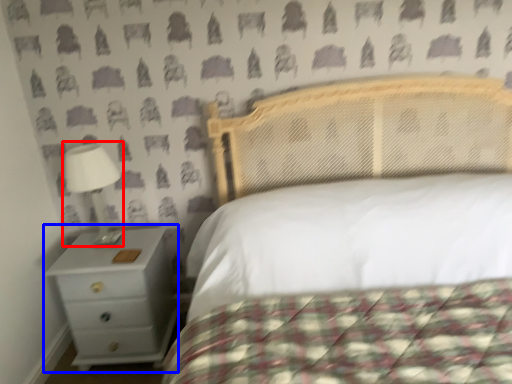
Question: Which point is further to the camera, lamp (highlighted by a red box) or nightstand (highlighted by a blue box)?

Choices:
 (A) lamp
 (B) nightstand

Answer: (B)